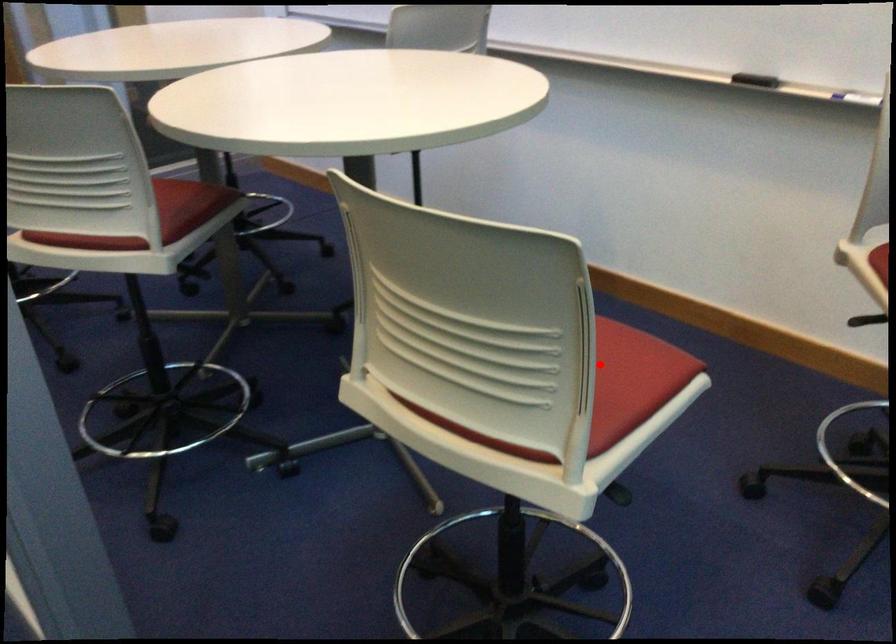
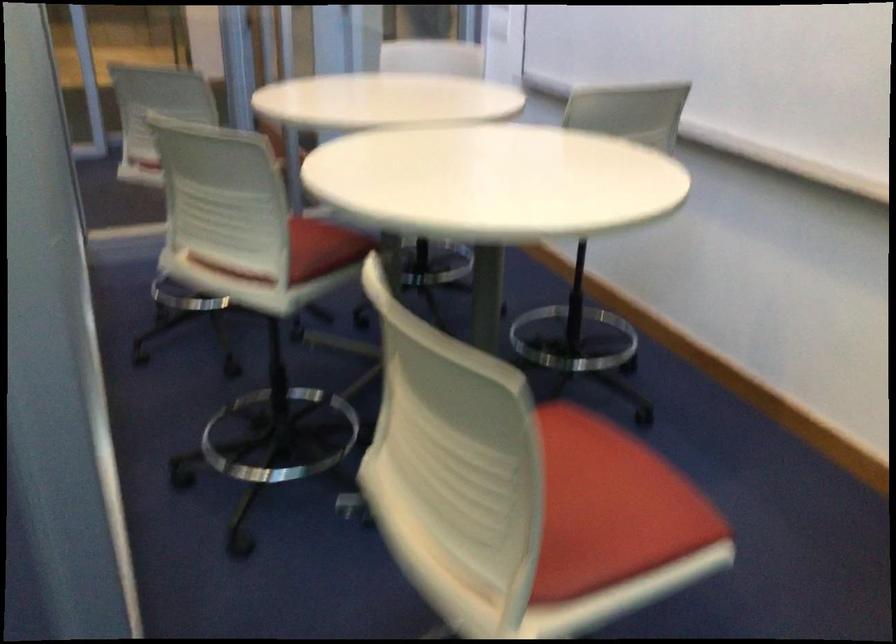
Question: I am providing you with two images of the same scene from different viewpoints. A red point is marked on the first image. Is the red point's position out of view in image 2?

Choices:
 (A) Yes
 (B) No

Answer: (B)